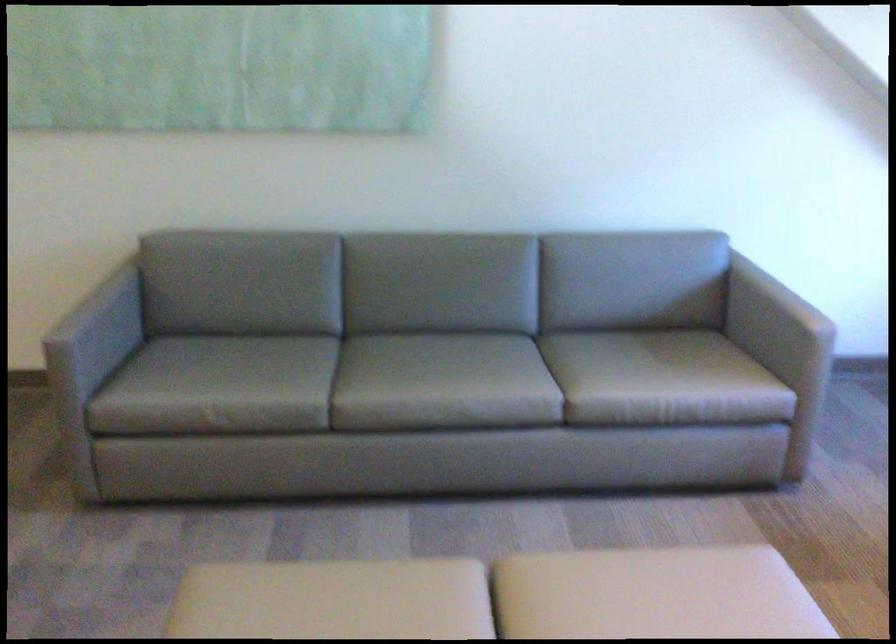
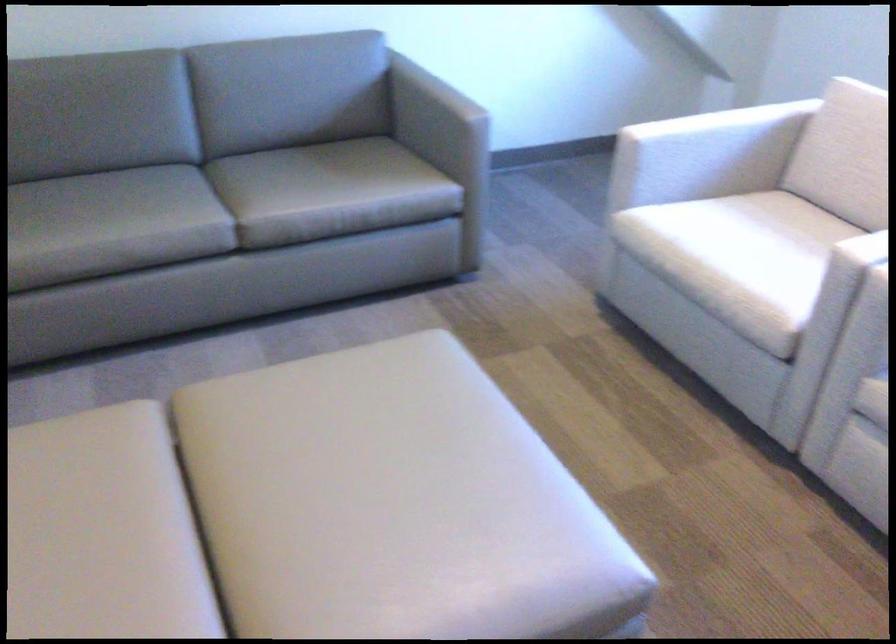
In the second image, find the point that corresponds to point (803, 317) in the first image.

(457, 104)